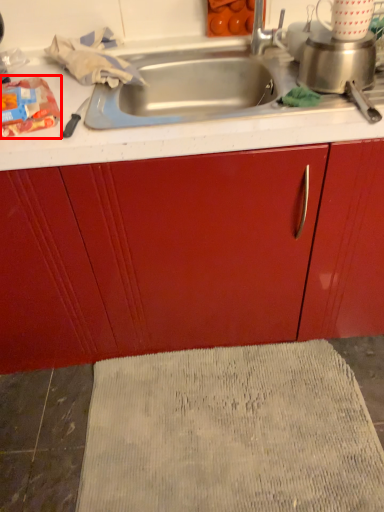
Question: Considering the relative positions of food (annotated by the red box) and bath mat in the image provided, where is food (annotated by the red box) located with respect to the staircase?

Choices:
 (A) left
 (B) right

Answer: (A)